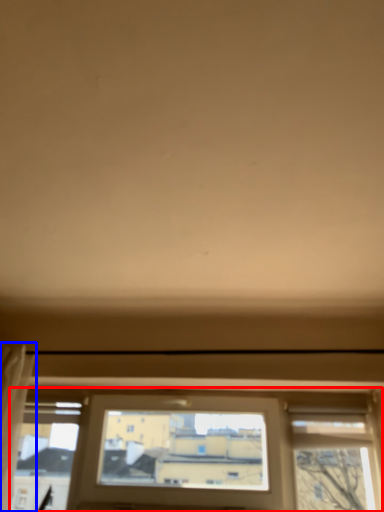
Question: Among these objects, which one is nearest to the camera, window (highlighted by a red box) or curtain (highlighted by a blue box)?

Choices:
 (A) window
 (B) curtain

Answer: (B)